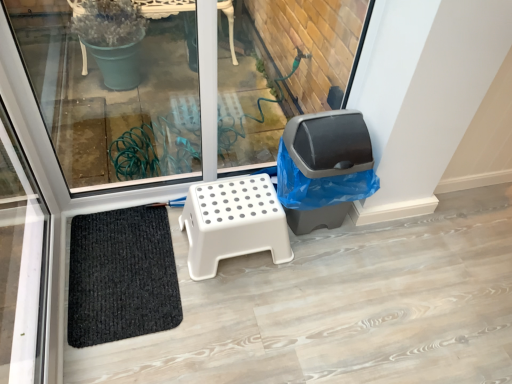
I want to click on vacant space to the right of black woven mat at lower left, so click(x=230, y=301).